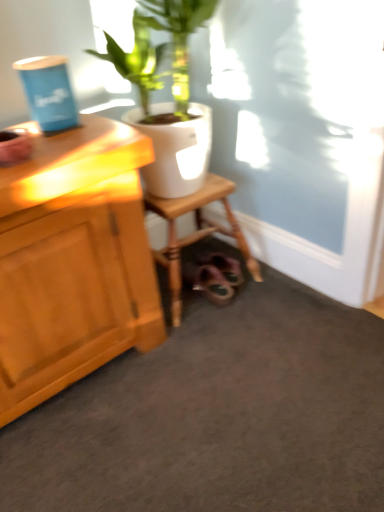
The image size is (384, 512). What are the coordinates of `unoccupied area in front of wooden stool at lower center` in the screenshot? It's located at (211, 352).